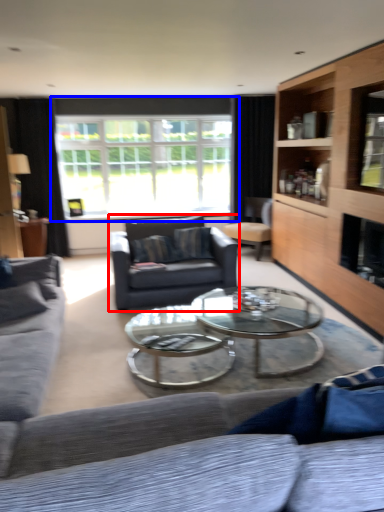
Question: Which object is closer to the camera taking this photo, swivel chair (highlighted by a red box) or window (highlighted by a blue box)?

Choices:
 (A) swivel chair
 (B) window

Answer: (A)